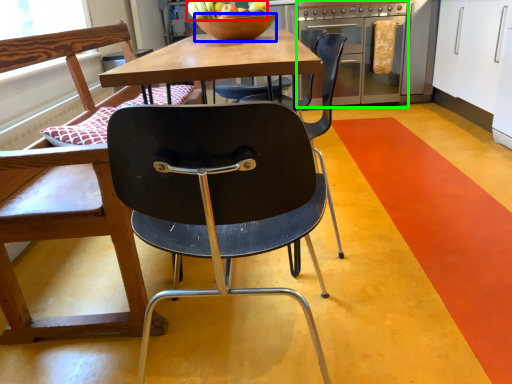
Question: Which object is the farthest from fruit (highlighted by a red box)? Choose among these: bowl (highlighted by a blue box) or oven (highlighted by a green box).

Choices:
 (A) bowl
 (B) oven

Answer: (B)